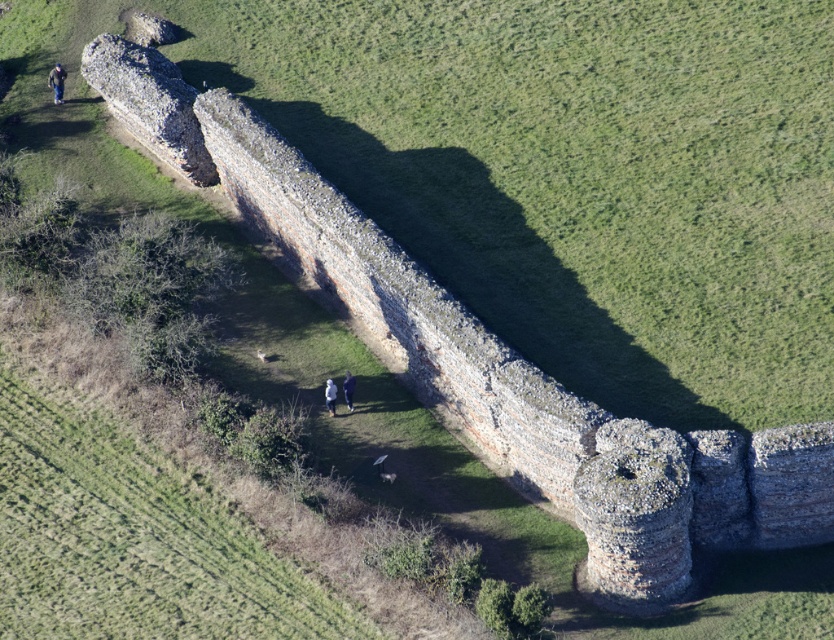
Which is below, white fabric jacket at center or blue fabric jacket at center?

white fabric jacket at center is lower down.

From the picture: Is white fabric jacket at center smaller than blue fabric jacket at center?

Correct, white fabric jacket at center occupies less space than blue fabric jacket at center.

The width and height of the screenshot is (834, 640). In order to click on white fabric jacket at center in this screenshot , I will do `click(330, 396)`.

At what (x,y) coordinates should I click in order to perform the action: click on white fabric jacket at center. Please return your answer as a coordinate pair (x, y). Looking at the image, I should click on (330, 396).

At what (x,y) coordinates should I click in order to perform the action: click on dark blue jeans at upper left. Please return your answer as a coordinate pair (x, y). The image size is (834, 640). Looking at the image, I should click on (56, 83).

Which is more to the right, dark blue jeans at upper left or white fabric jacket at center?

From the viewer's perspective, white fabric jacket at center appears more on the right side.

The width and height of the screenshot is (834, 640). Identify the location of dark blue jeans at upper left. (56, 83).

At what (x,y) coordinates should I click in order to perform the action: click on dark blue jeans at upper left. Please return your answer as a coordinate pair (x, y). The width and height of the screenshot is (834, 640). Looking at the image, I should click on (56, 83).

Does point (53, 86) come in front of point (344, 387)?

No, it is behind (344, 387).

Is dark blue jeans at upper left in front of blue fabric jacket at center?

No, dark blue jeans at upper left is behind blue fabric jacket at center.

Between point (63, 80) and point (352, 388), which one is positioned behind?

Positioned behind is point (63, 80).

Find the location of a particular element. The height and width of the screenshot is (640, 834). dark blue jeans at upper left is located at coordinates (56, 83).